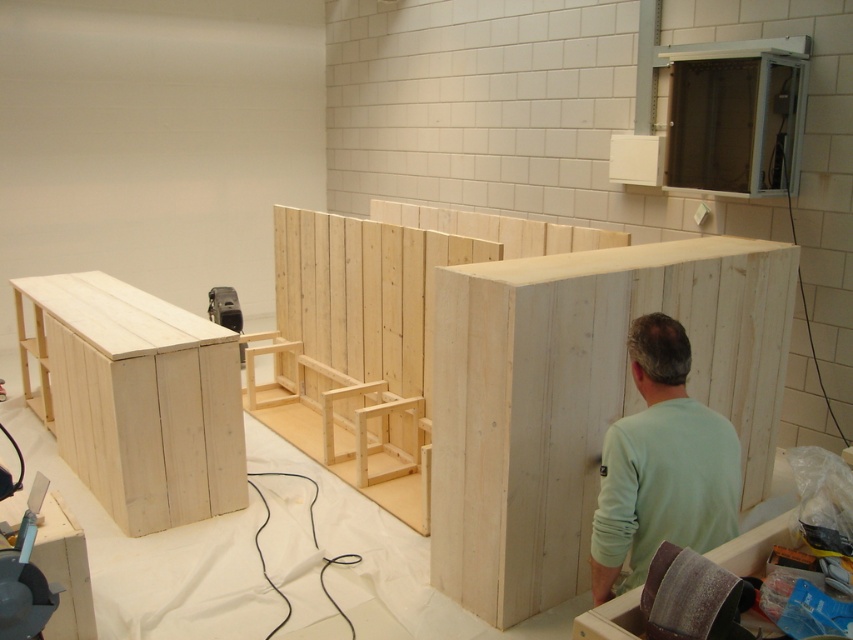
Which of these two, natural wood cabinet at center or light green fabric at center, stands shorter?

light green fabric at center

Does natural wood cabinet at center have a greater height compared to light green fabric at center?

Indeed, natural wood cabinet at center has a greater height compared to light green fabric at center.

Which is behind, point (582, 349) or point (674, 417)?

Point (582, 349)

In order to click on natural wood cabinet at center in this screenshot , I will do `click(579, 397)`.